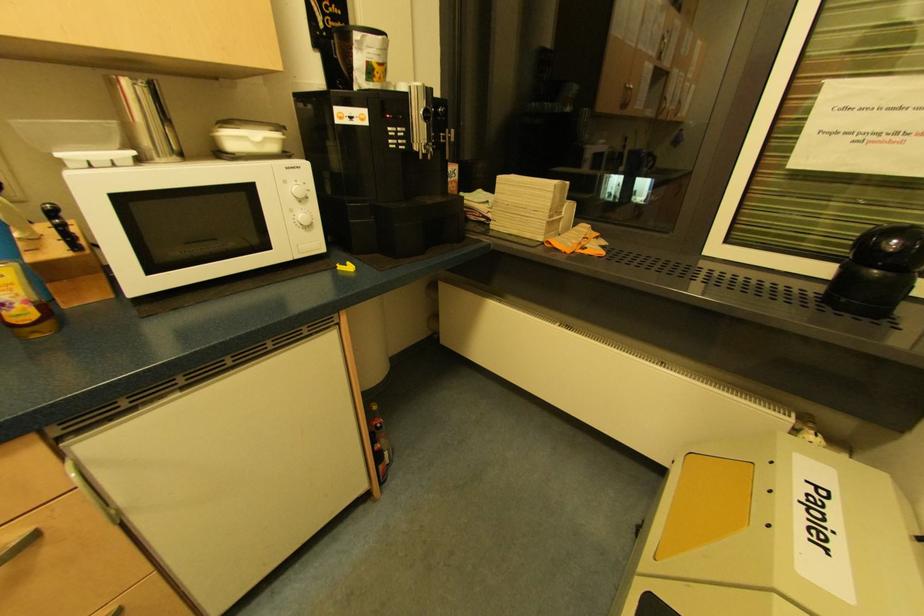
The image size is (924, 616). Identify the location of yellow bin flap. pos(707,504).